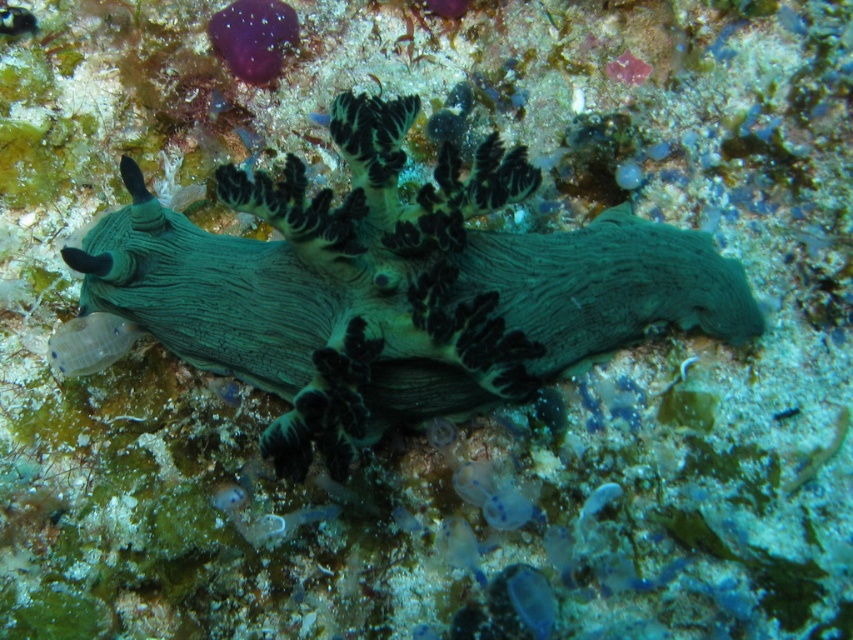
You are a marine biologist studying underwater life. You observe the point marked at coordinates (395, 285) in the image. What marine creature is located exactly at that point?

The point marked at coordinates (395, 285) marks the green rubbery sea slug at center.

You are a marine biologist observing this underwater scene. You notice the green rubbery sea slug at center and the translucent gelatinous at left. Which of these two organisms is located to the left of the other?

The green rubbery sea slug at center is positioned on the right side of the translucent gelatinous at left, so the translucent gelatinous at left is to the left of the green rubbery sea slug at center.

Based on the photo, you are a marine biologist observing the underwater scene. You notice the translucent blue jellyfish at center and the translucent blue fish at upper center. Based on their positions, which one is located more to the right?

The translucent blue jellyfish at center is more to the right than the translucent blue fish at upper center.